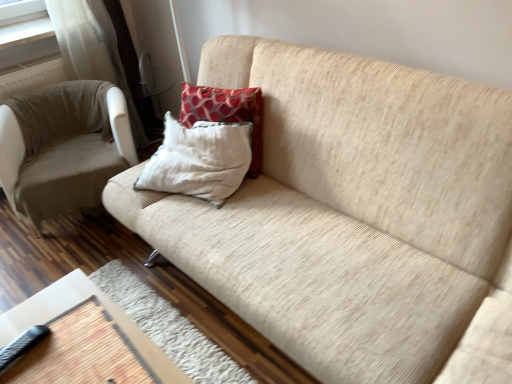
What do you see at coordinates (22, 345) in the screenshot?
I see `black rubberized remote at lower left` at bounding box center [22, 345].

The image size is (512, 384). Describe the element at coordinates (84, 339) in the screenshot. I see `wooden table at lower left` at that location.

In order to face beige fabric chair at left, should I rotate leftwards or rightwards?

You should look left and rotate roughly 22.746 degrees.

Identify the location of red textured pillow at upper center, acting as the second pillow starting from the front. This screenshot has width=512, height=384. click(226, 113).

Can you tell me how much red textured pillow at center, acting as the 1th pillow starting from the front, and black rubberized remote at lower left differ in facing direction?

10.2 degrees.

Which object is positioned more to the right, red textured pillow at center, the 2th pillow in the back-to-front sequence, or black rubberized remote at lower left?

Positioned to the right is red textured pillow at center, the 2th pillow in the back-to-front sequence.

Are red textured pillow at center, the 2th pillow in the back-to-front sequence, and black rubberized remote at lower left beside each other?

No, red textured pillow at center, the 2th pillow in the back-to-front sequence, is not in contact with black rubberized remote at lower left.

In the scene shown: Considering the relative sizes of red textured pillow at center, the 2th pillow in the back-to-front sequence, and black rubberized remote at lower left in the image provided, is red textured pillow at center, the 2th pillow in the back-to-front sequence, smaller than black rubberized remote at lower left?

No, red textured pillow at center, the 2th pillow in the back-to-front sequence, is not smaller than black rubberized remote at lower left.

From the image's perspective, is wooden table at lower left located beneath red textured pillow at center, the 2th pillow in the back-to-front sequence?

Yes, from the image's perspective, wooden table at lower left is beneath red textured pillow at center, the 2th pillow in the back-to-front sequence.

From a real-world perspective, does wooden table at lower left sit lower than red textured pillow at center, the 2th pillow in the back-to-front sequence?

Correct, in the physical world, wooden table at lower left is lower than red textured pillow at center, the 2th pillow in the back-to-front sequence.

Would you consider wooden table at lower left to be distant from red textured pillow at center, the 2th pillow in the back-to-front sequence?

wooden table at lower left is near red textured pillow at center, the 2th pillow in the back-to-front sequence, not far away.

From a real-world perspective, is wooden table at lower left located beneath beige fabric couch at center?

Yes, from a real-world perspective, wooden table at lower left is below beige fabric couch at center.

How different are the orientations of wooden table at lower left and beige fabric couch at center in degrees?

wooden table at lower left and beige fabric couch at center are facing 90.4 degrees away from each other.

Which object is thinner, wooden table at lower left or beige fabric couch at center?

Thinner between the two is wooden table at lower left.

Which of these two, wooden table at lower left or beige fabric couch at center, is smaller?

wooden table at lower left.

Considering the relative sizes of beige fabric couch at center and black rubberized remote at lower left in the image provided, is beige fabric couch at center bigger than black rubberized remote at lower left?

Indeed, beige fabric couch at center has a larger size compared to black rubberized remote at lower left.

In terms of height, does beige fabric couch at center look taller or shorter compared to black rubberized remote at lower left?

In the image, beige fabric couch at center appears to be taller than black rubberized remote at lower left.

Is beige fabric couch at center further to the viewer compared to black rubberized remote at lower left?

No, the depth of beige fabric couch at center is less than that of black rubberized remote at lower left.

Does beige fabric couch at center appear on the left side of black rubberized remote at lower left?

In fact, beige fabric couch at center is to the right of black rubberized remote at lower left.

Find the location of `the 2nd pillow above the beige fabric chair at left (from a real-world perspective)`. the 2nd pillow above the beige fabric chair at left (from a real-world perspective) is located at coordinates coord(199,160).

Which of these two, red textured pillow at center, the 2th pillow in the back-to-front sequence, or beige fabric chair at left, stands shorter?

With less height is red textured pillow at center, the 2th pillow in the back-to-front sequence.

Does red textured pillow at center, the 2th pillow in the back-to-front sequence, touch beige fabric chair at left?

red textured pillow at center, the 2th pillow in the back-to-front sequence, is not next to beige fabric chair at left, and they're not touching.

From a real-world perspective, relative to beige fabric chair at left, is red textured pillow at center, acting as the 1th pillow starting from the front, vertically above or below?

In terms of real-world spatial position, red textured pillow at center, acting as the 1th pillow starting from the front, is above beige fabric chair at left.

Does beige fabric couch at center turn towards red textured pillow at upper center, acting as the second pillow starting from the front?

Yes, beige fabric couch at center is oriented towards red textured pillow at upper center, acting as the second pillow starting from the front.

The width and height of the screenshot is (512, 384). I want to click on the 2nd pillow above the beige fabric couch at center (from the image's perspective), so click(x=226, y=113).

Which object is positioned more to the left, beige fabric couch at center or red textured pillow at upper center, acting as the 1th pillow starting from the back?

red textured pillow at upper center, acting as the 1th pillow starting from the back.

Which is in front, point (318, 239) or point (221, 89)?

The point (318, 239) is closer.

Considering the relative positions of beige fabric couch at center and wooden table at lower left in the image provided, is beige fabric couch at center to the left of wooden table at lower left from the viewer's perspective?

In fact, beige fabric couch at center is to the right of wooden table at lower left.

How far apart are beige fabric couch at center and wooden table at lower left?

They are 26.51 inches apart.

Is beige fabric couch at center inside or outside of wooden table at lower left?

beige fabric couch at center is outside wooden table at lower left.

Which object is more forward, beige fabric couch at center or wooden table at lower left?

beige fabric couch at center is in front.

This screenshot has height=384, width=512. Identify the location of remote in front of the red textured pillow at center, the 2th pillow in the back-to-front sequence. (22, 345).

At what (x,y) coordinates should I click in order to perform the action: click on the 2nd pillow above the wooden table at lower left (from a real-world perspective). Please return your answer as a coordinate pair (x, y). The image size is (512, 384). Looking at the image, I should click on (199, 160).

From the image, which object appears to be nearer to red textured pillow at center, the 2th pillow in the back-to-front sequence, red textured pillow at upper center, acting as the second pillow starting from the front, or black rubberized remote at lower left?

Based on the image, red textured pillow at upper center, acting as the second pillow starting from the front, appears to be nearer to red textured pillow at center, the 2th pillow in the back-to-front sequence.

Looking at the image, which one is located closer to beige fabric couch at center, beige fabric chair at left or red textured pillow at center, acting as the 1th pillow starting from the front?

Among the two, red textured pillow at center, acting as the 1th pillow starting from the front, is located nearer to beige fabric couch at center.

Which object lies further to the anchor point red textured pillow at center, acting as the 1th pillow starting from the front, red textured pillow at upper center, acting as the 1th pillow starting from the back, or beige fabric couch at center?

beige fabric couch at center is further to red textured pillow at center, acting as the 1th pillow starting from the front.

From the image, which object appears to be nearer to red textured pillow at upper center, acting as the second pillow starting from the front, wooden table at lower left or red textured pillow at center, acting as the 1th pillow starting from the front?

red textured pillow at center, acting as the 1th pillow starting from the front.

From the image, which object appears to be farther from black rubberized remote at lower left, red textured pillow at center, the 2th pillow in the back-to-front sequence, or beige fabric couch at center?

beige fabric couch at center is further to black rubberized remote at lower left.

Which object lies nearer to the anchor point beige fabric couch at center, red textured pillow at center, acting as the 1th pillow starting from the front, or black rubberized remote at lower left?

Based on the image, red textured pillow at center, acting as the 1th pillow starting from the front, appears to be nearer to beige fabric couch at center.

Estimate the real-world distances between objects in this image. Which object is further from wooden table at lower left, red textured pillow at upper center, acting as the second pillow starting from the front, or beige fabric couch at center?

red textured pillow at upper center, acting as the second pillow starting from the front, is positioned further to the anchor wooden table at lower left.

Based on their spatial positions, is red textured pillow at upper center, acting as the 1th pillow starting from the back, or beige fabric couch at center further from black rubberized remote at lower left?

red textured pillow at upper center, acting as the 1th pillow starting from the back, is further to black rubberized remote at lower left.

The width and height of the screenshot is (512, 384). I want to click on chair between red textured pillow at center, acting as the 1th pillow starting from the front, and black rubberized remote at lower left from top to bottom, so click(63, 164).

Locate an element on the screen. The image size is (512, 384). pillow between red textured pillow at upper center, acting as the 1th pillow starting from the back, and black rubberized remote at lower left, in the vertical direction is located at coordinates (199, 160).

The height and width of the screenshot is (384, 512). I want to click on remote between beige fabric chair at left and red textured pillow at upper center, acting as the second pillow starting from the front, in the horizontal direction, so click(22, 345).

This screenshot has width=512, height=384. Identify the location of table between beige fabric couch at center and red textured pillow at center, the 2th pillow in the back-to-front sequence, from front to back. point(84,339).